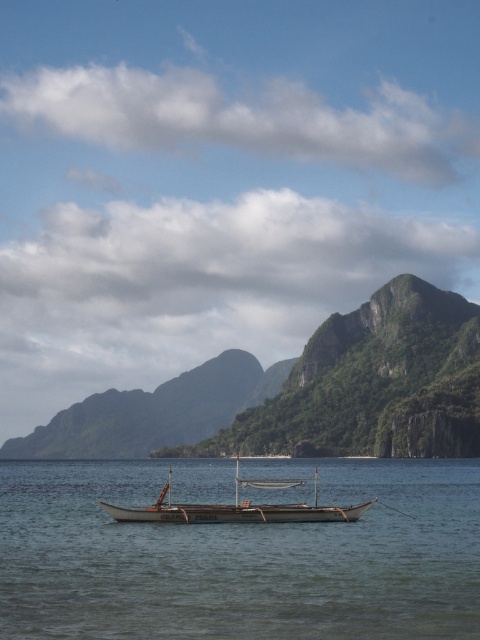
Question: Does clear water at boat center appear on the left side of green textured mountain at center?

Choices:
 (A) yes
 (B) no

Answer: (A)

Question: Does clear water at boat center have a larger size compared to wooden boat at center?

Choices:
 (A) yes
 (B) no

Answer: (A)

Question: Is clear water at boat center closer to camera compared to green textured mountain at center?

Choices:
 (A) yes
 (B) no

Answer: (A)

Question: Which point appears closest to the camera in this image?

Choices:
 (A) (441, 305)
 (B) (216, 589)

Answer: (B)

Question: Which point is closer to the camera taking this photo?

Choices:
 (A) (277, 506)
 (B) (56, 449)

Answer: (A)

Question: Which object is positioned farthest from the green textured mountain at center?

Choices:
 (A) wooden boat at center
 (B) clear water at boat center

Answer: (A)